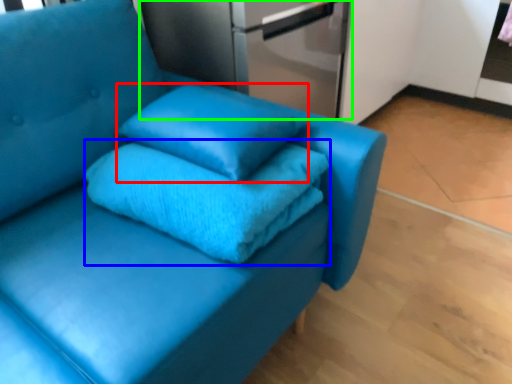
Question: Based on their relative distances, which object is nearer to pillow (highlighted by a red box)? Choose from bath towel (highlighted by a blue box) and appliance (highlighted by a green box).

Choices:
 (A) bath towel
 (B) appliance

Answer: (A)